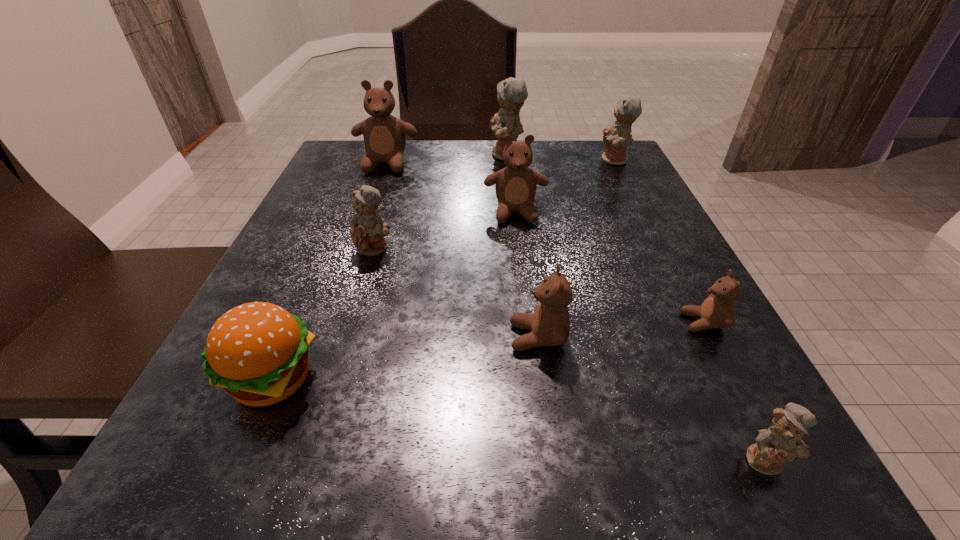
Find the location of a particular element. This screenshot has height=540, width=960. the biggest blue teddy bear is located at coordinates (512, 93).

This screenshot has width=960, height=540. Identify the location of the farthest brown teddy bear. (384, 136).

Find the location of `the leftmost brown teddy bear`. the leftmost brown teddy bear is located at coordinates (384, 136).

This screenshot has height=540, width=960. I want to click on the second biggest blue teddy bear, so click(x=616, y=138).

You are a GUI agent. You are given a task and a screenshot of the screen. Output one action in this format:
    pyautogui.click(x=<x>, y=<y>)
    Task: Click on the second biggest brown teddy bear
    
    Given the screenshot: What is the action you would take?
    pyautogui.click(x=516, y=184)

Locate an element on the screen. the second farthest brown teddy bear is located at coordinates (516, 184).

This screenshot has width=960, height=540. Find the location of `the fifth farthest object`. the fifth farthest object is located at coordinates (368, 228).

The image size is (960, 540). Identify the location of the fourth nearest teddy bear. (368, 228).

Locate an element on the screen. The width and height of the screenshot is (960, 540). the third biggest brown teddy bear is located at coordinates (550, 324).

This screenshot has height=540, width=960. What are the coordinates of `hamburger` in the screenshot? It's located at (258, 352).